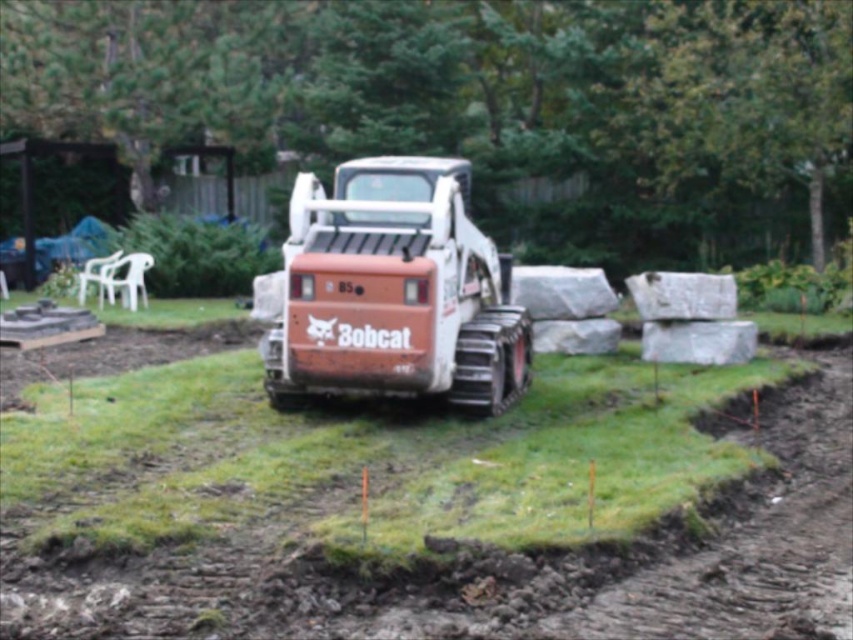
Is point (344, 422) positioned in front of point (387, 236)?

Yes.

Image resolution: width=853 pixels, height=640 pixels. I want to click on green grass at center, so click(x=370, y=452).